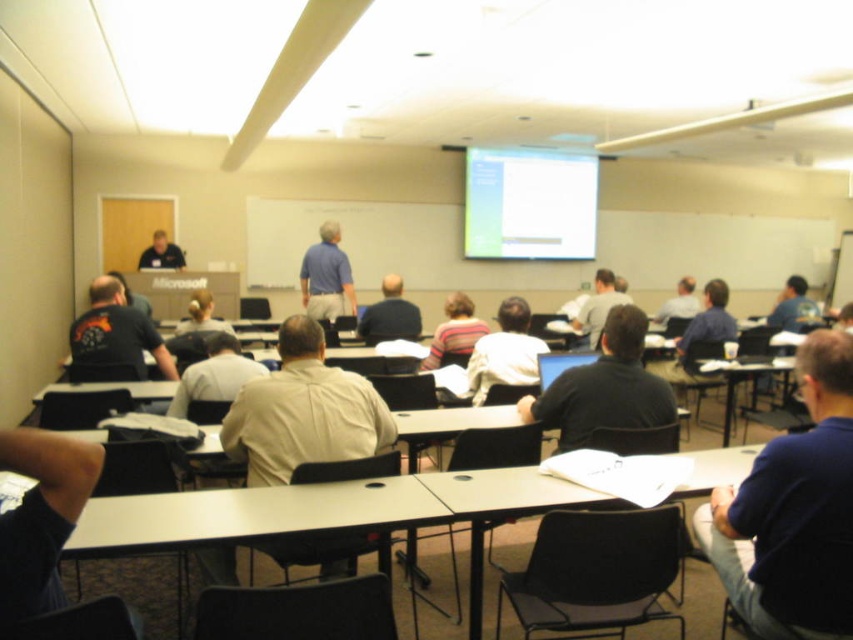
Based on the photo, between smooth plastic table at center and light brown hair at center, which one has less height?

light brown hair at center is shorter.

Is smooth plastic table at center to the right of light brown hair at center from the viewer's perspective?

Incorrect, smooth plastic table at center is not on the right side of light brown hair at center.

At what (x,y) coordinates should I click in order to perform the action: click on smooth plastic table at center. Please return your answer as a coordinate pair (x, y). Image resolution: width=853 pixels, height=640 pixels. Looking at the image, I should click on (743, 380).

Is point (219, 372) farther from viewer compared to point (340, 250)?

No, (219, 372) is in front of (340, 250).

Does light beige shirt at center have a larger size compared to blue cotton shirt at center?

Actually, light beige shirt at center might be smaller than blue cotton shirt at center.

Is point (181, 385) more distant than point (317, 276)?

No, it is in front of (317, 276).

At what (x,y) coordinates should I click in order to perform the action: click on light beige shirt at center. Please return your answer as a coordinate pair (x, y). The width and height of the screenshot is (853, 640). Looking at the image, I should click on (213, 374).

Is point (212, 397) less distant than point (366, 333)?

Yes, it is.

Where is `light beige shirt at center`? The height and width of the screenshot is (640, 853). light beige shirt at center is located at coordinates (213, 374).